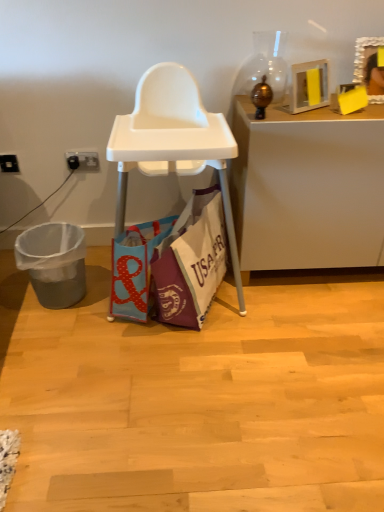
Question: In terms of height, does black plastic power outlet at lower left, the 2th power outlet in the right-to-left sequence, look taller or shorter compared to white plastic power outlet at lower left, which is counted as the first power outlet, starting from the right?

Choices:
 (A) short
 (B) tall

Answer: (A)

Question: In the image, is black plastic power outlet at lower left, the 2th power outlet in the right-to-left sequence, positioned in front of or behind white plastic power outlet at lower left, the second power outlet when ordered from left to right?

Choices:
 (A) front
 (B) behind

Answer: (A)

Question: Which is farther from the blue fabric bag at center, which is the first handbag from left to right?

Choices:
 (A) white glossy desk at upper right
 (B) white plastic power outlet at lower left, the second power outlet when ordered from left to right
 (C) purple fabric bag at center, which is counted as the 1th handbag, starting from the right
 (D) white plastic high chair at center
 (E) gray plastic trash can at lower left

Answer: (B)

Question: Estimate the real-world distances between objects in this image. Which object is farther from the wooden picture frame at upper right?

Choices:
 (A) white plastic power outlet at lower left, which is counted as the first power outlet, starting from the right
 (B) purple fabric bag at center, which is the second handbag from left to right
 (C) blue fabric bag at center, which is the first handbag from left to right
 (D) white plastic high chair at center
 (E) gray plastic trash can at lower left

Answer: (E)